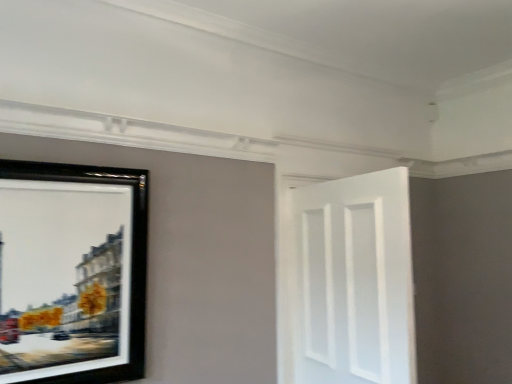
Locate an element on the screen. The width and height of the screenshot is (512, 384). black matte picture frame at left is located at coordinates (72, 273).

Measure the distance between black matte picture frame at left and camera.

A distance of 5.63 feet exists between black matte picture frame at left and camera.

What do you see at coordinates (72, 273) in the screenshot? The width and height of the screenshot is (512, 384). I see `black matte picture frame at left` at bounding box center [72, 273].

What are the coordinates of `white matte door at right` in the screenshot? It's located at (353, 280).

The width and height of the screenshot is (512, 384). Describe the element at coordinates (353, 280) in the screenshot. I see `white matte door at right` at that location.

Measure the distance between white matte door at right and camera.

white matte door at right is 1.81 meters away from camera.

The width and height of the screenshot is (512, 384). Find the location of `black matte picture frame at left`. black matte picture frame at left is located at coordinates (72, 273).

Can you confirm if black matte picture frame at left is positioned to the right of white matte door at right?

Incorrect, black matte picture frame at left is not on the right side of white matte door at right.

Is black matte picture frame at left in front of or behind white matte door at right in the image?

Visually, black matte picture frame at left is located in front of white matte door at right.

Considering the positions of points (129, 250) and (396, 210), is point (129, 250) farther from camera compared to point (396, 210)?

Yes, point (129, 250) is behind point (396, 210).

From the image's perspective, is black matte picture frame at left above or below white matte door at right?

black matte picture frame at left is situated higher than white matte door at right in the image.

From a real-world perspective, is black matte picture frame at left located beneath white matte door at right?

No.

Can you confirm if black matte picture frame at left is wider than white matte door at right?

Incorrect, the width of black matte picture frame at left does not surpass that of white matte door at right.

Between black matte picture frame at left and white matte door at right, which one has less height?

Result: With less height is black matte picture frame at left.

Considering the sizes of black matte picture frame at left and white matte door at right in the image, is black matte picture frame at left bigger or smaller than white matte door at right?

Clearly, black matte picture frame at left is smaller in size than white matte door at right.

Is black matte picture frame at left positioned beyond the bounds of white matte door at right?

Absolutely, black matte picture frame at left is external to white matte door at right.

Is black matte picture frame at left far from white matte door at right?

That's right, there is a large distance between black matte picture frame at left and white matte door at right.

Is black matte picture frame at left looking in the opposite direction of white matte door at right?

No, white matte door at right is not at the back of black matte picture frame at left.

Where is `picture frame that is in front of the white matte door at right`? The width and height of the screenshot is (512, 384). picture frame that is in front of the white matte door at right is located at coordinates (72, 273).

In the image, is white matte door at right on the left side or the right side of black matte picture frame at left?

white matte door at right is positioned on black matte picture frame at left's right side.

Is white matte door at right in front of black matte picture frame at left?

No, it is not.

Does point (376, 301) lie in front of point (24, 186)?

That is False.

From the image's perspective, is white matte door at right located above or below black matte picture frame at left?

Clearly, from the image's perspective, white matte door at right is below black matte picture frame at left.

From a real-world perspective, which object rests below the other?

white matte door at right.

Which object is wider, white matte door at right or black matte picture frame at left?

white matte door at right.

Considering the sizes of objects white matte door at right and black matte picture frame at left in the image provided, who is shorter, white matte door at right or black matte picture frame at left?

black matte picture frame at left.

Considering the sizes of objects white matte door at right and black matte picture frame at left in the image provided, who is bigger, white matte door at right or black matte picture frame at left?

white matte door at right.

Would you say white matte door at right is outside black matte picture frame at left?

white matte door at right is positioned outside black matte picture frame at left.

Are white matte door at right and black matte picture frame at left far apart?

white matte door at right is positioned a significant distance from black matte picture frame at left.

Is white matte door at right looking in the opposite direction of black matte picture frame at left?

Yes, white matte door at right is positioned with its back facing black matte picture frame at left.

How many degrees apart are the facing directions of white matte door at right and black matte picture frame at left?

They differ by 84.5 degrees in their facing directions.

Find the location of a particular element. The image size is (512, 384). door that is below the black matte picture frame at left (from the image's perspective) is located at coordinates (353, 280).

This screenshot has height=384, width=512. What are the coordinates of `picture frame located in front of the white matte door at right` in the screenshot? It's located at (72, 273).

Identify the location of door on the right of black matte picture frame at left. (353, 280).